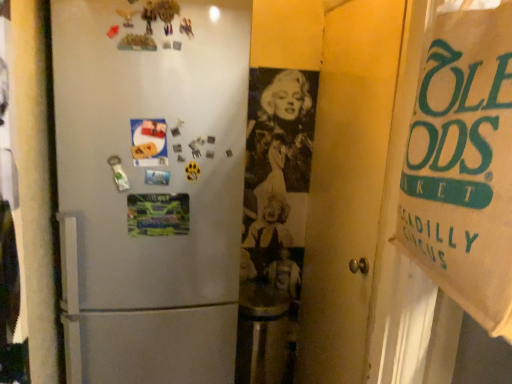
Question: Considering the positions of brown paper bag at right and matte paper postcard at center left, arranged as the 1th postcard when viewed from the top, in the image, is brown paper bag at right taller or shorter than matte paper postcard at center left, arranged as the 1th postcard when viewed from the top,?

Choices:
 (A) short
 (B) tall

Answer: (B)

Question: Is brown paper bag at right bigger or smaller than matte paper postcard at center left, arranged as the 1th postcard when viewed from the top?

Choices:
 (A) big
 (B) small

Answer: (A)

Question: Which object is positioned closest to the matte paper postcard at center left, arranged as the 1th postcard when viewed from the top?

Choices:
 (A) multicolored paper at center, which is counted as the second postcard, starting from the top
 (B) brown paper bag at right

Answer: (A)

Question: Which object is the farthest from the brown paper bag at right?

Choices:
 (A) multicolored paper at center, which is the 1th postcard in bottom-to-top order
 (B) matte paper postcard at center left, arranged as the 1th postcard when viewed from the top

Answer: (A)